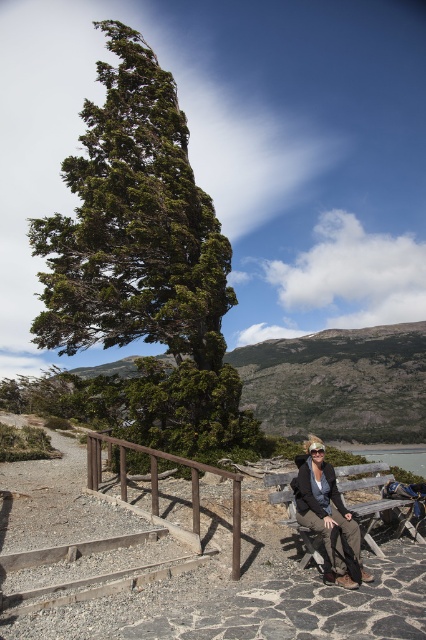
You are planning to set up a small tent in this area. Considering the green textured tree at center and the clear blue water at lower right, which location would be more suitable for the tent to avoid strong winds?

The clear blue water at lower right is more suitable for setting up the tent because the green textured tree at center is much taller and may block the wind, but since the tree is leaning and its branches are bent, it might not provide sufficient shelter. Alternatively, the water area might be more exposed, but the question is about avoiding strong winds. Wait, the tree is in a windy area, so maybe the water is more exposed. Hmm, need to check the scene description again. The tree is in a windy area with a

You are standing at the wooden bench to the right of the frame and want to walk towards the tree. Which point, point (226, 380) or point (195, 529), is closer to you?

Point (195, 529) is closer to you since it is in front of point (226, 380), which is behind it.